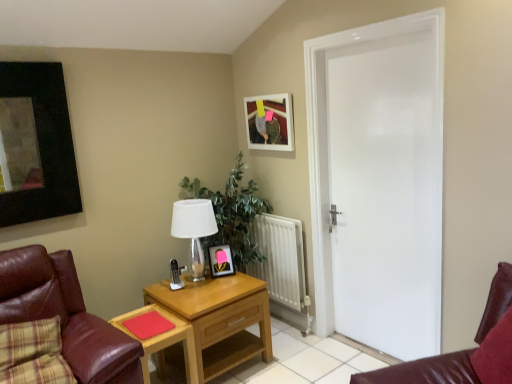
Question: Looking at the image, does wooden table at center seem bigger or smaller compared to matte black picture frame at center, the 2th picture frame from the right?

Choices:
 (A) big
 (B) small

Answer: (A)

Question: From the image's perspective, is wooden table at center positioned above or below matte black picture frame at center, which is counted as the first picture frame, starting from the bottom?

Choices:
 (A) above
 (B) below

Answer: (B)

Question: Which is farther from the smooth red paper at lower center?

Choices:
 (A) white glossy door at right
 (B) white glass table lamp at center
 (C) green leafy plant at center
 (D) wooden table at center
 (E) leather at left

Answer: (A)

Question: Which object is positioned farthest from the matte black picture frame at center, which is counted as the first picture frame, starting from the bottom?

Choices:
 (A) smooth red paper at lower center
 (B) leather at left
 (C) white metallic radiator at center
 (D) green leafy plant at center
 (E) wooden table at center

Answer: (B)